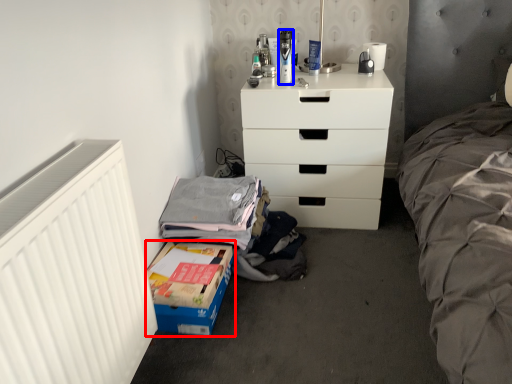
Question: Which object is closer to the camera taking this photo, box (highlighted by a red box) or toiletry (highlighted by a blue box)?

Choices:
 (A) box
 (B) toiletry

Answer: (A)